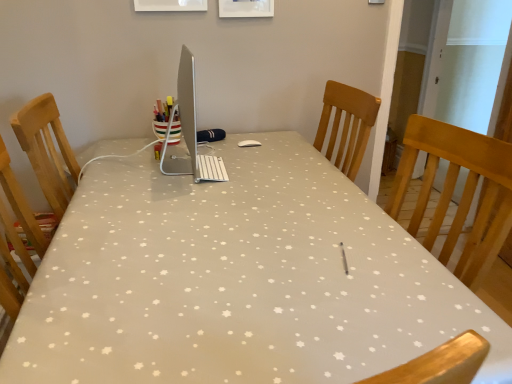
Question: Considering the positions of point (448, 279) and point (194, 165), is point (448, 279) closer or farther from the camera than point (194, 165)?

Choices:
 (A) farther
 (B) closer

Answer: (B)

Question: Would you say white fabric table at center is to the left or to the right of sleek silver desktop at center in the picture?

Choices:
 (A) right
 (B) left

Answer: (A)

Question: In terms of size, does white fabric table at center appear bigger or smaller than sleek silver desktop at center?

Choices:
 (A) big
 (B) small

Answer: (A)

Question: From the image's perspective, is sleek silver desktop at center located above or below white fabric table at center?

Choices:
 (A) below
 (B) above

Answer: (B)

Question: Is point (224, 172) closer or farther from the camera than point (246, 183)?

Choices:
 (A) farther
 (B) closer

Answer: (A)

Question: Is sleek silver desktop at center wider or thinner than white fabric table at center?

Choices:
 (A) wide
 (B) thin

Answer: (B)

Question: From their relative heights in the image, would you say sleek silver desktop at center is taller or shorter than white fabric table at center?

Choices:
 (A) short
 (B) tall

Answer: (A)